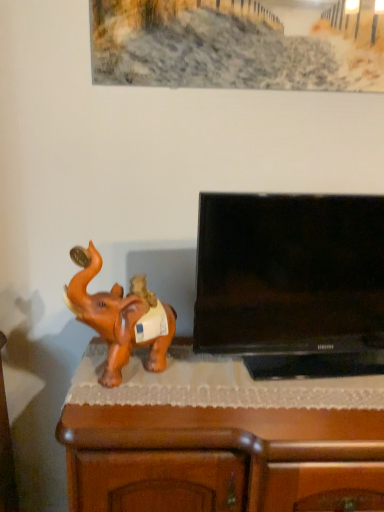
I want to click on space that is in front of brown glossy elephant at left, so click(126, 408).